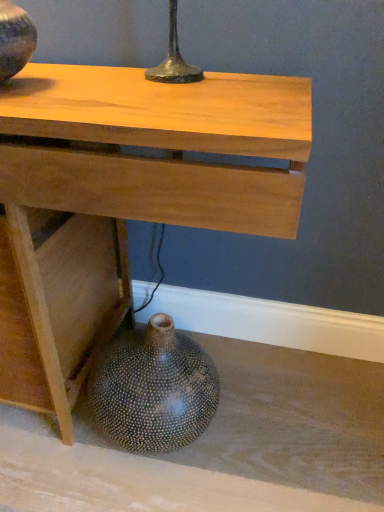
Find the location of a particular element. vacant area that is in front of speckled ceramic vase at lower left, placed as the 1th vase when sorted from back to front is located at coordinates (147, 490).